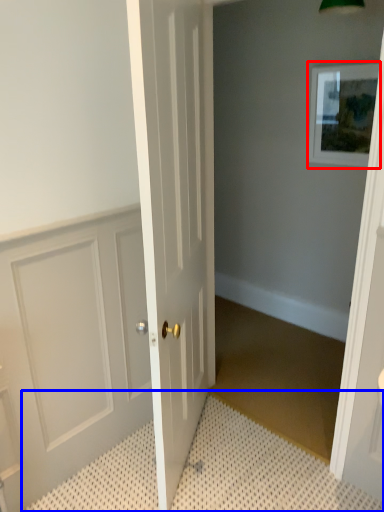
Question: Which of the following is the closest to the observer, picture frame (highlighted by a red box) or bath mat (highlighted by a blue box)?

Choices:
 (A) picture frame
 (B) bath mat

Answer: (B)